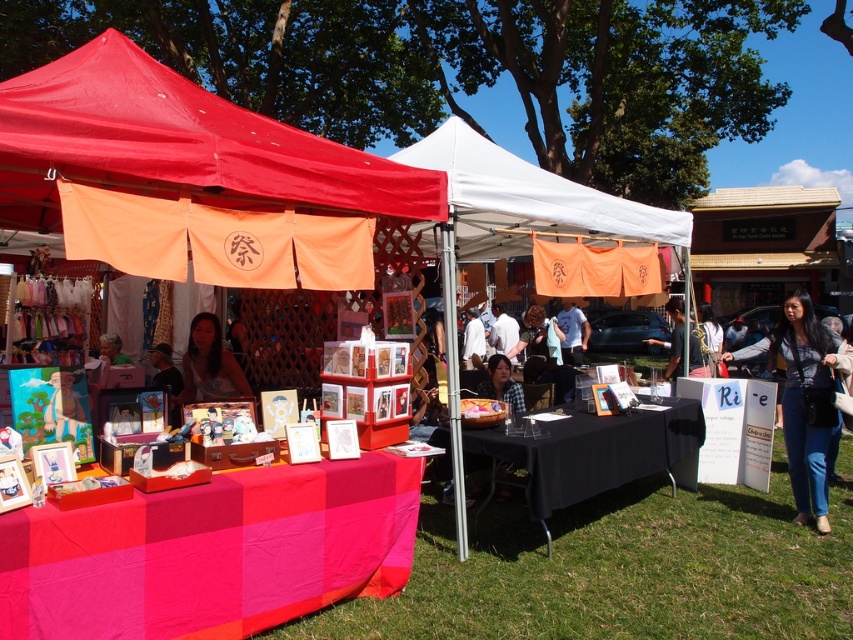
Question: From the image, what is the correct spatial relationship of red fabric canopy at upper left in relation to matte black hair at center?

Choices:
 (A) left
 (B) right

Answer: (B)

Question: Which object appears closest to the camera in this image?

Choices:
 (A) white fabric canopy at center
 (B) black leather jacket at lower right

Answer: (A)

Question: Which of the following is the closest to the observer?

Choices:
 (A) (49, 205)
 (B) (531, 189)
 (C) (440, 436)
 (D) (572, 342)

Answer: (B)

Question: Which of these objects is positioned farthest from the black leather jacket at lower right?

Choices:
 (A) white fabric canopy at center
 (B) dark blue jeans at center
 (C) red fabric canopy at upper left

Answer: (C)

Question: Considering the relative positions of red fabric canopy at upper left and white fabric canopy at center in the image provided, where is red fabric canopy at upper left located with respect to white fabric canopy at center?

Choices:
 (A) left
 (B) right

Answer: (A)

Question: Does white fabric canopy at center come behind matte white shirt at center?

Choices:
 (A) yes
 (B) no

Answer: (B)